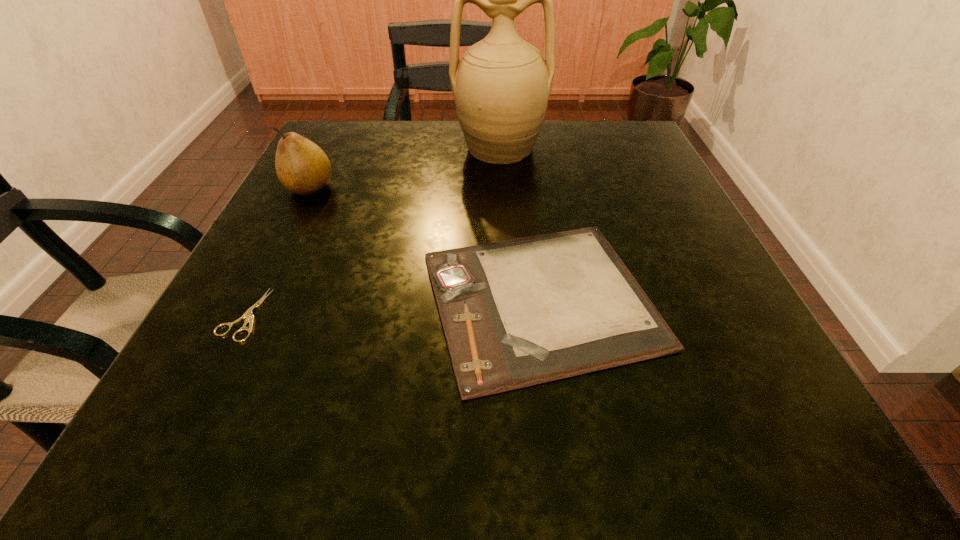
The height and width of the screenshot is (540, 960). In order to click on the tallest object in this screenshot , I will do click(x=501, y=86).

Find the location of a particular element. This screenshot has height=540, width=960. the farthest object is located at coordinates (501, 86).

Find the location of a particular element. This screenshot has height=540, width=960. pear is located at coordinates (302, 167).

Where is `the third shortest object`? the third shortest object is located at coordinates pos(302,167).

The width and height of the screenshot is (960, 540). I want to click on the second shortest object, so click(515, 313).

Identify the location of shears. (248, 314).

Locate an element on the screen. vacant area located 0.160m on the right of the pitcher is located at coordinates (618, 148).

Where is `free space located 0.390m on the right of the second tallest object`? free space located 0.390m on the right of the second tallest object is located at coordinates (535, 187).

Where is `vacant space situated on the back of the clipboard`? This screenshot has width=960, height=540. vacant space situated on the back of the clipboard is located at coordinates (520, 151).

Find the location of a particular element. Image resolution: width=960 pixels, height=540 pixels. vacant space located on the back of the shortest object is located at coordinates (289, 225).